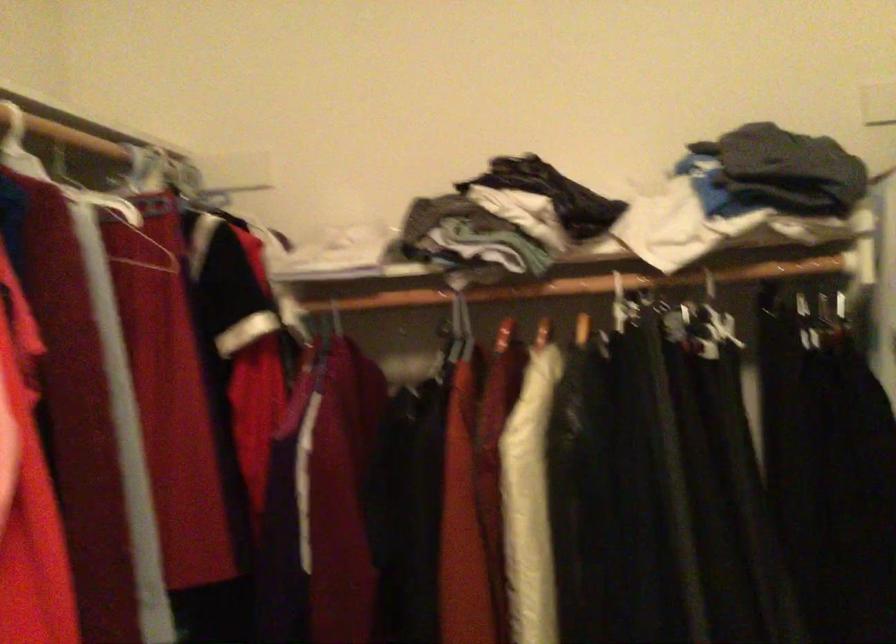
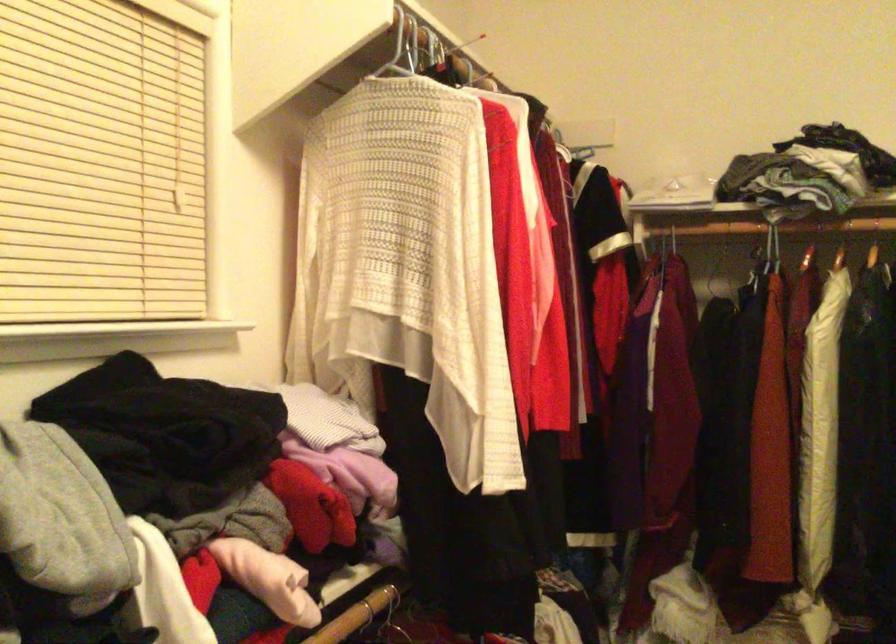
Locate, in the second image, the point that corresponds to pixel 455 297 in the first image.

(774, 228)